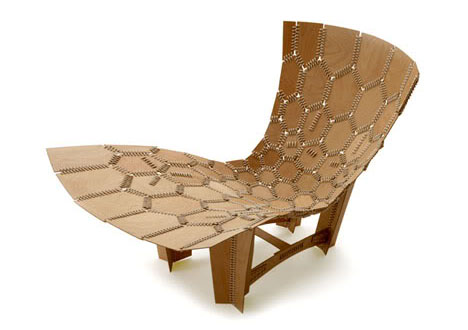
You are a GUI agent. You are given a task and a screenshot of the screen. Output one action in this format:
    pyautogui.click(x=<x>, y=<y>)
    Task: Click on the left back chair leg
    This screenshot has width=468, height=330.
    Given the screenshot: What is the action you would take?
    pyautogui.click(x=289, y=222)